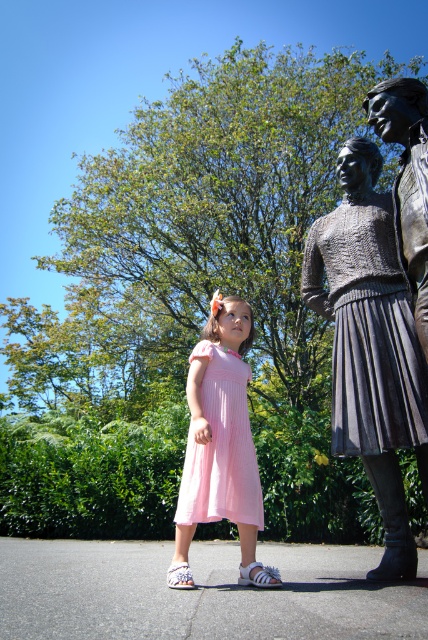
Who is shorter, bronze statue at right or pink pleated dress at center?

pink pleated dress at center is shorter.

Can you confirm if bronze statue at right is positioned above pink pleated dress at center?

Correct, bronze statue at right is located above pink pleated dress at center.

Which is in front, point (368, 232) or point (208, 506)?

Positioned in front is point (208, 506).

This screenshot has height=640, width=428. What are the coordinates of `bronze statue at right` in the screenshot? It's located at (371, 344).

Does point (232, 490) lie behind point (382, 138)?

That is True.

I want to click on pink pleated dress at center, so click(220, 448).

Where is `pink pleated dress at center`? pink pleated dress at center is located at coordinates (220, 448).

Between bronze statue at right and bronze statue at upper right, which one has more height?

Standing taller between the two is bronze statue at right.

Describe the element at coordinates (371, 344) in the screenshot. The image size is (428, 640). I see `bronze statue at right` at that location.

Does point (410, 422) come closer to viewer compared to point (416, 260)?

That is False.

Identify the location of bronze statue at right. Image resolution: width=428 pixels, height=640 pixels. (371, 344).